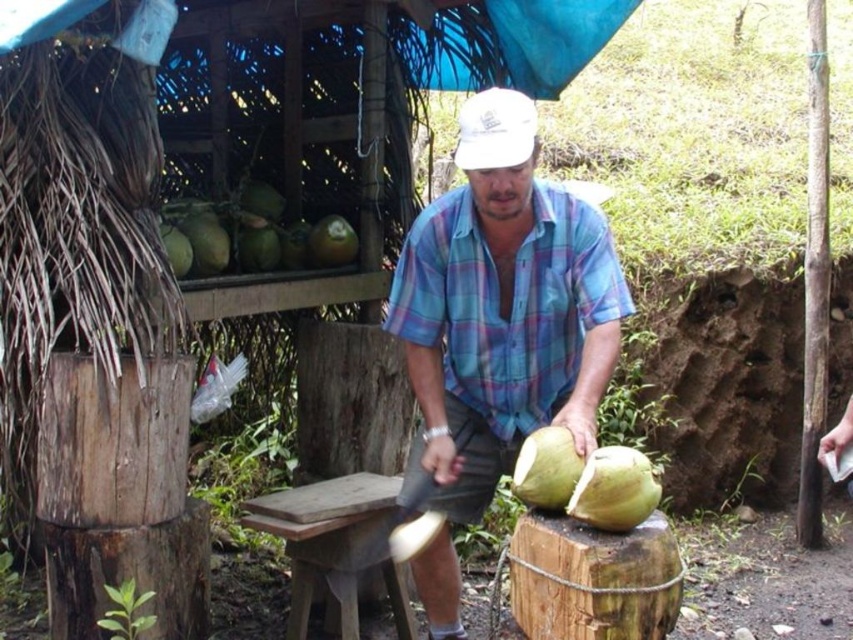
Question: Is green coconut at upper left to the right of green rough coconut at center from the viewer's perspective?

Choices:
 (A) no
 (B) yes

Answer: (A)

Question: Can you confirm if white matte baseball cap at center is smaller than green rough coconut at center?

Choices:
 (A) no
 (B) yes

Answer: (A)

Question: Which point appears farthest from the camera in this image?

Choices:
 (A) (576, 332)
 (B) (616, 513)
 (C) (514, 492)

Answer: (A)

Question: Which of the following is the farthest from the observer?

Choices:
 (A) (612, 531)
 (B) (521, 484)
 (C) (432, 476)

Answer: (C)

Question: Which object appears closest to the camera in this image?

Choices:
 (A) blue plaid shirt at center
 (B) green matte coconut at center

Answer: (B)

Question: Does blue plaid shirt at center have a greater width compared to white matte baseball cap at center?

Choices:
 (A) no
 (B) yes

Answer: (B)